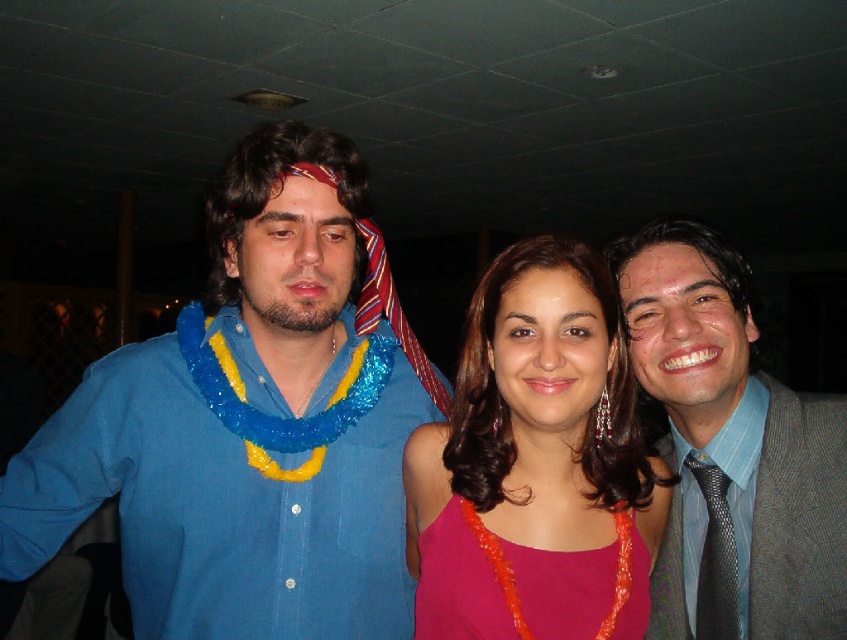
Question: Is gray textured suit at right to the right of blue striped shirt at right from the viewer's perspective?

Choices:
 (A) yes
 (B) no

Answer: (B)

Question: Is shiny pink fabric dress at center further to camera compared to black textured tie at right?

Choices:
 (A) no
 (B) yes

Answer: (A)

Question: Is shiny pink fabric dress at center bigger than blue striped shirt at right?

Choices:
 (A) yes
 (B) no

Answer: (B)

Question: Which of these objects is positioned closest to the blue striped shirt at right?

Choices:
 (A) shiny pink fabric dress at center
 (B) gray textured suit at right
 (C) pink fabric dress at center
 (D) black textured tie at right

Answer: (D)

Question: Which of the following is the closest to the observer?

Choices:
 (A) (833, 596)
 (B) (76, 524)
 (C) (692, 548)

Answer: (A)

Question: Among these objects, which one is farthest from the camera?

Choices:
 (A) blue striped shirt at right
 (B) gray textured suit at right

Answer: (A)